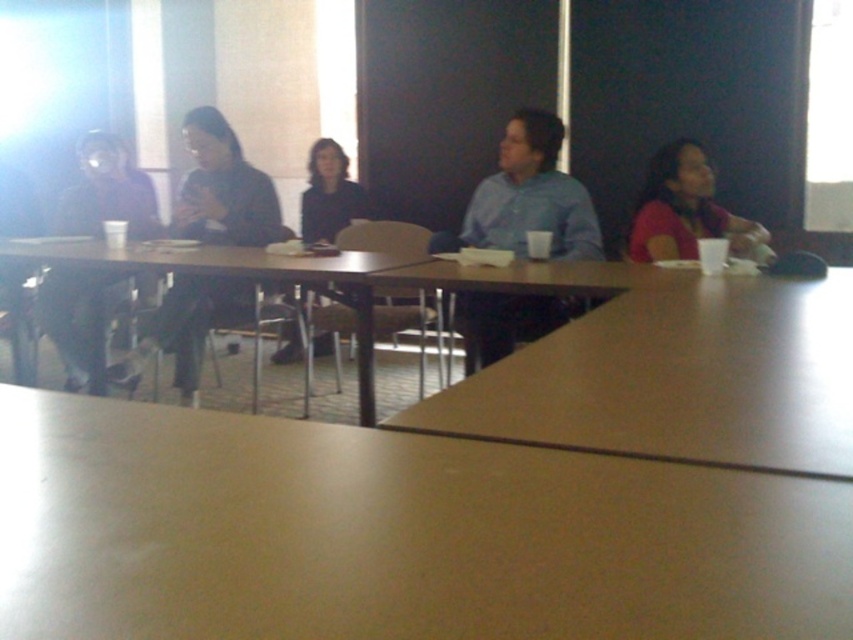
Can you confirm if smooth beige table at center is positioned below dark gray sweater at center?

Yes.

Which is below, smooth beige table at center or dark gray sweater at center?

smooth beige table at center

Is point (83, 448) closer to camera compared to point (183, 285)?

Yes.

Identify the location of smooth beige table at center. (392, 534).

Is dark gray sweater at center closer to camera compared to brown wooden table at center?

That is False.

What do you see at coordinates (223, 188) in the screenshot? I see `dark gray sweater at center` at bounding box center [223, 188].

Identify the location of dark gray sweater at center. The image size is (853, 640). (223, 188).

Is brown wooden table at center shorter than matte black jacket at center?

No.

Which is more to the left, brown wooden table at center or matte black jacket at center?

brown wooden table at center is more to the left.

Identify the location of brown wooden table at center. (251, 280).

Locate an element on the screen. brown wooden table at center is located at coordinates (251, 280).